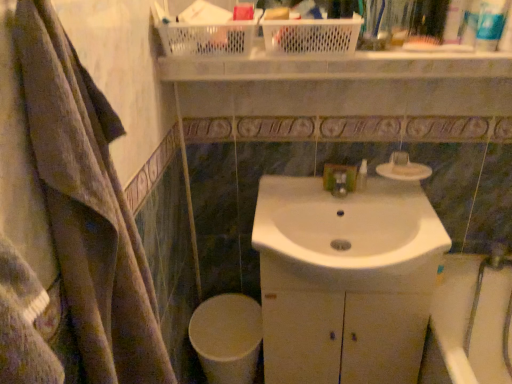
Identify the location of free space to the left of white matte soap at upper center. The image size is (512, 384). (362, 183).